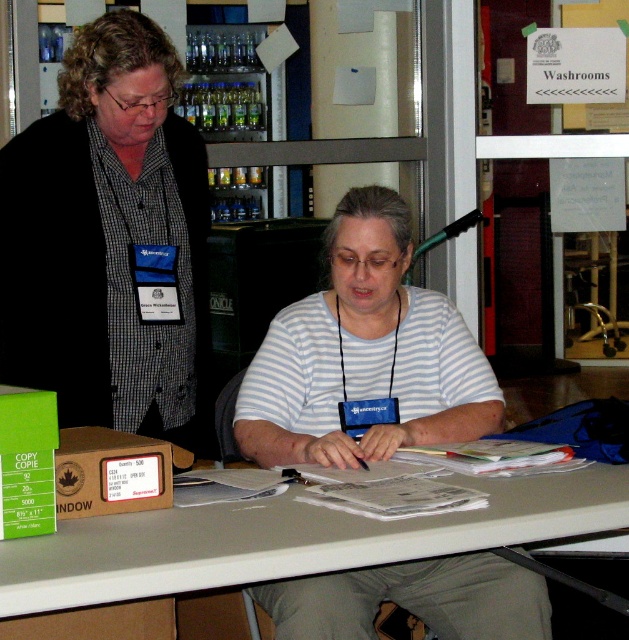
Is checkered fabric shirt at left bigger than smooth gray table at center?

→ Correct, checkered fabric shirt at left is larger in size than smooth gray table at center.

Is checkered fabric shirt at left shorter than smooth gray table at center?

Incorrect, checkered fabric shirt at left's height does not fall short of smooth gray table at center's.

Which is in front, point (191, 424) or point (86, 554)?

Point (86, 554) is in front.

Identify the location of checkered fabric shirt at left. (108, 241).

Which is more to the left, checkered fabric shirt at left or white striped shirt at center?

From the viewer's perspective, checkered fabric shirt at left appears more on the left side.

Is checkered fabric shirt at left below white striped shirt at center?

Incorrect, checkered fabric shirt at left is not positioned below white striped shirt at center.

This screenshot has height=640, width=629. I want to click on checkered fabric shirt at left, so click(x=108, y=241).

Locate an element on the screen. Image resolution: width=629 pixels, height=640 pixels. checkered fabric shirt at left is located at coordinates (108, 241).

Between checkered fabric shirt at left and brown cardboard box at lower left, which one is positioned lower?

brown cardboard box at lower left is lower down.

Is checkered fabric shirt at left below brown cardboard box at lower left?

No.

This screenshot has width=629, height=640. Identify the location of checkered fabric shirt at left. (108, 241).